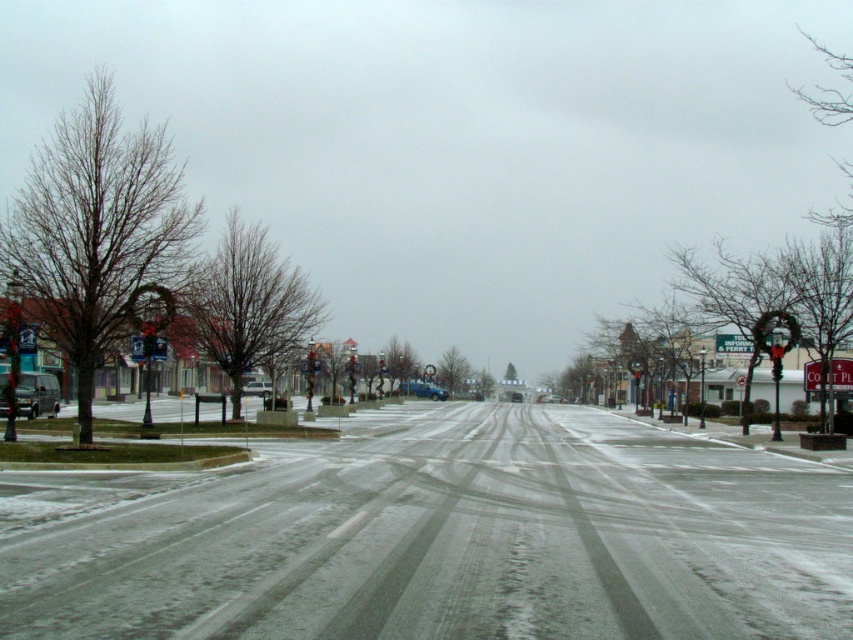
Question: Is white powdery snow at center wider than shiny black van at left?

Choices:
 (A) yes
 (B) no

Answer: (A)

Question: Does white powdery snow at center have a smaller size compared to shiny black van at left?

Choices:
 (A) yes
 (B) no

Answer: (B)

Question: Can you confirm if white powdery snow at center is thinner than shiny black van at left?

Choices:
 (A) no
 (B) yes

Answer: (A)